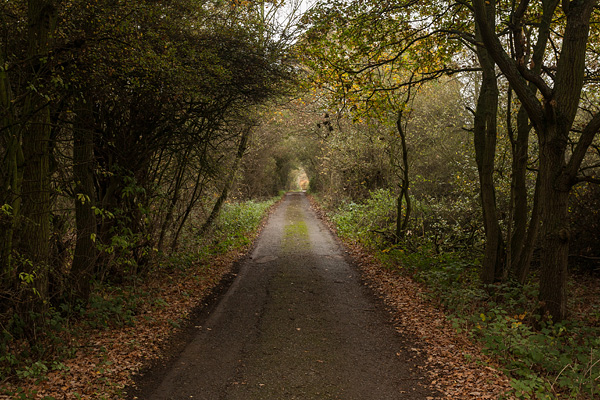
Find the location of a particular element. The height and width of the screenshot is (400, 600). light in the background is located at coordinates (302, 187).